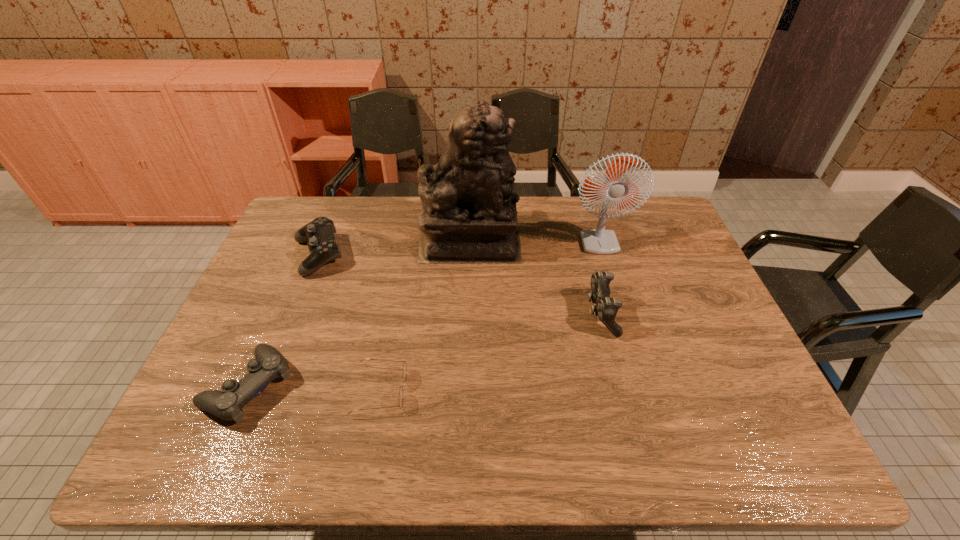
Find the location of a particular element. The height and width of the screenshot is (540, 960). vacant point located on the front-facing side of the second tallest object is located at coordinates (625, 271).

The width and height of the screenshot is (960, 540). Identify the location of vacant space situated on the surface of the tallest control with buttons. click(543, 314).

The image size is (960, 540). Identify the location of vacant region located on the surface of the tallest control with buttons. (543, 314).

This screenshot has height=540, width=960. In order to click on vacant space located 0.130m on the surface of the tallest control with buttons in this screenshot , I will do `click(540, 314)`.

The height and width of the screenshot is (540, 960). In order to click on free space located on the right of the farthest control in this screenshot , I will do point(385,256).

Where is `vacant region located on the back of the shortest control`? vacant region located on the back of the shortest control is located at coordinates (299, 269).

The height and width of the screenshot is (540, 960). Find the location of `free location located 0.100m on the temples of the spectacles`. free location located 0.100m on the temples of the spectacles is located at coordinates (449, 390).

Where is `sculpture that is at the far edge`? sculpture that is at the far edge is located at coordinates (469, 215).

You are a GUI agent. You are given a task and a screenshot of the screen. Output one action in this format:
    pyautogui.click(x=<x>, y=<y>)
    Task: Click on the fan that is positioned at the far edge
    This screenshot has width=960, height=540.
    Given the screenshot: What is the action you would take?
    pyautogui.click(x=595, y=241)

This screenshot has height=540, width=960. Identify the location of control present at the far edge. (319, 234).